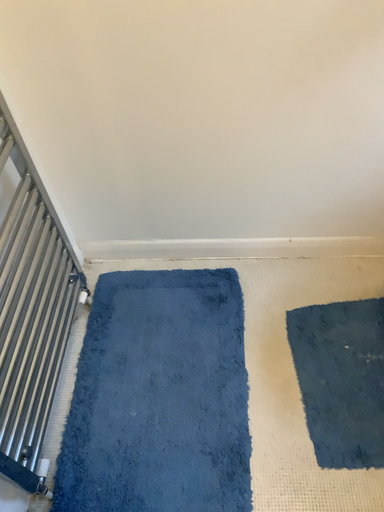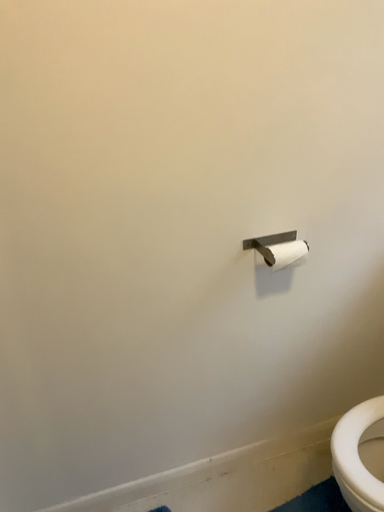
Question: Which way did the camera rotate in the video?

Choices:
 (A) rotated downward
 (B) rotated upward

Answer: (B)